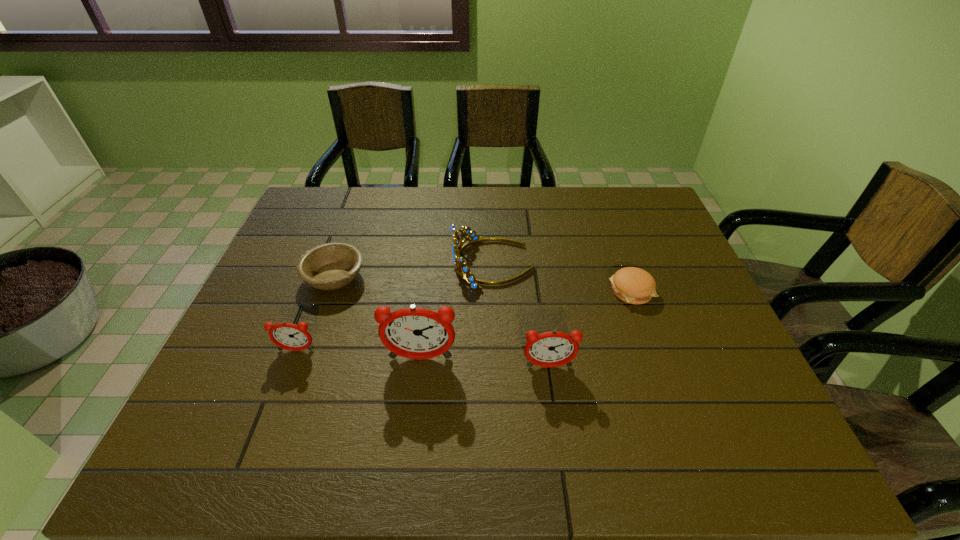
You are a GUI agent. You are given a task and a screenshot of the screen. Output one action in this format:
    pyautogui.click(x=<x>, y=<y>)
    Task: Click on the vacant space at the left edge of the desktop
    The image size is (960, 540).
    Given the screenshot: What is the action you would take?
    pyautogui.click(x=285, y=266)

Locate an element on the screen. vacant space at the right edge is located at coordinates (653, 265).

This screenshot has height=540, width=960. In the image, there is a desktop. In order to click on vacant space at the far left corner in this screenshot , I will do `click(341, 213)`.

In the image, there is a desktop. At what (x,y) coordinates should I click in order to perform the action: click on vacant space at the near left corner. Please return your answer as a coordinate pair (x, y). This screenshot has height=540, width=960. Looking at the image, I should click on (217, 408).

Identify the location of vacant area at the far right corner of the desktop. (636, 200).

Identify the location of vacant region at the near right corner of the desktop. (740, 413).

Where is `vacant area that lies between the second tallest alarm clock and the second alarm clock from left to right`? This screenshot has height=540, width=960. vacant area that lies between the second tallest alarm clock and the second alarm clock from left to right is located at coordinates (485, 362).

Image resolution: width=960 pixels, height=540 pixels. I want to click on unoccupied area between the tallest alarm clock and the fourth tallest object, so click(x=358, y=354).

This screenshot has width=960, height=540. In order to click on vacant space that's between the tallest object and the tiara in this screenshot , I will do `click(457, 311)`.

This screenshot has width=960, height=540. Find the location of `free spot between the rightmost alarm clock and the tallest alarm clock`. free spot between the rightmost alarm clock and the tallest alarm clock is located at coordinates (485, 362).